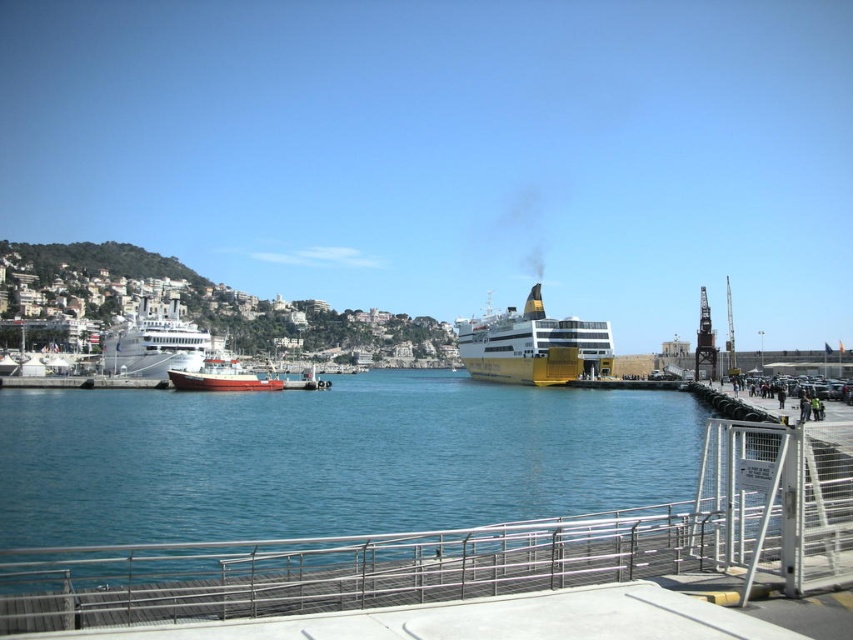
Who is positioned more to the left, yellow matte cruise ship at center or white glossy cruise ship at left?

Positioned to the left is white glossy cruise ship at left.

Does yellow matte cruise ship at center have a lesser width compared to white glossy cruise ship at left?

Yes, yellow matte cruise ship at center is thinner than white glossy cruise ship at left.

Where is `yellow matte cruise ship at center`? This screenshot has height=640, width=853. yellow matte cruise ship at center is located at coordinates (532, 346).

Who is taller, blue water at center or white glossy cruise ship at left?

Standing taller between the two is white glossy cruise ship at left.

Between blue water at center and white glossy cruise ship at left, which one has less height?

blue water at center is shorter.

Is point (42, 390) positioned in front of point (186, 365)?

Yes, it is in front of point (186, 365).

Where is `blue water at center`? blue water at center is located at coordinates (332, 458).

Is white glossy cruise ship at left thinner than red matte boat at center?

No.

Is point (165, 342) in front of point (216, 378)?

That is False.

Is point (212, 346) positioned behind point (224, 380)?

Yes, point (212, 346) is farther from viewer.

At what (x,y) coordinates should I click in order to perform the action: click on white glossy cruise ship at left. Please return your answer as a coordinate pair (x, y). The height and width of the screenshot is (640, 853). Looking at the image, I should click on (154, 342).